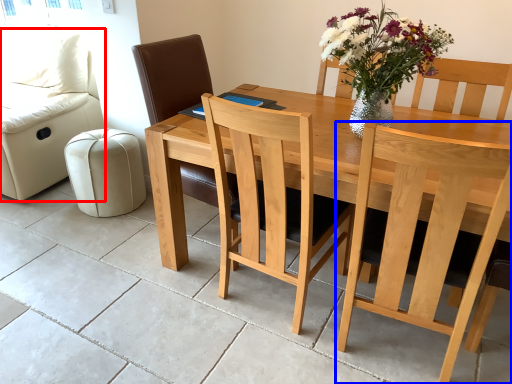
Question: Which object appears farthest to the camera in this image, couch (highlighted by a red box) or chair (highlighted by a blue box)?

Choices:
 (A) couch
 (B) chair

Answer: (A)